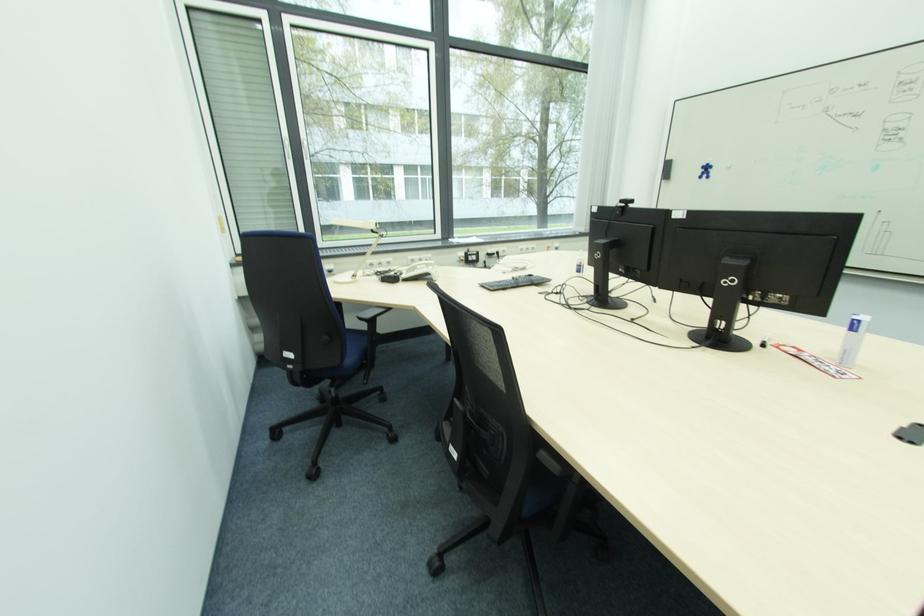
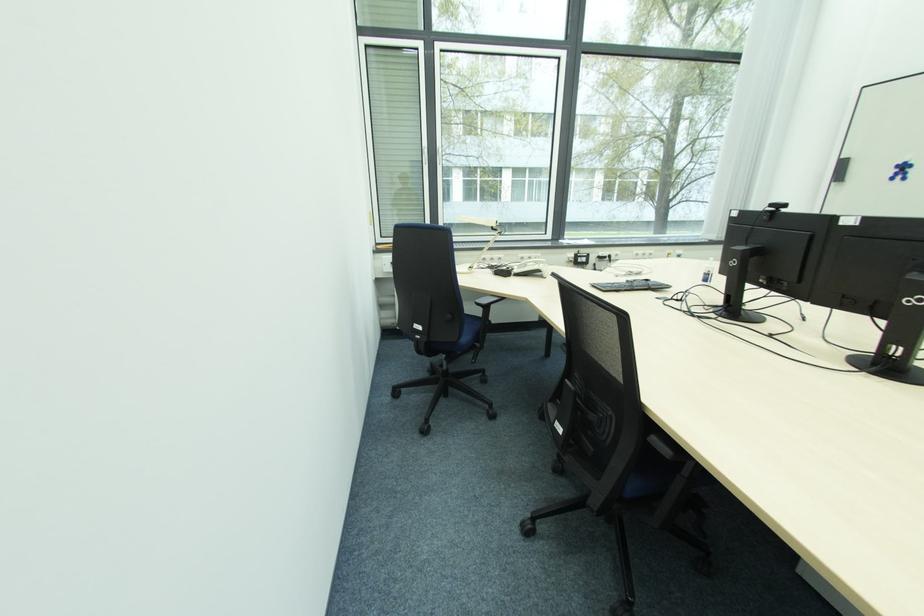
Where in the second image is the point corresponding to (378,233) from the first image?

(497, 230)